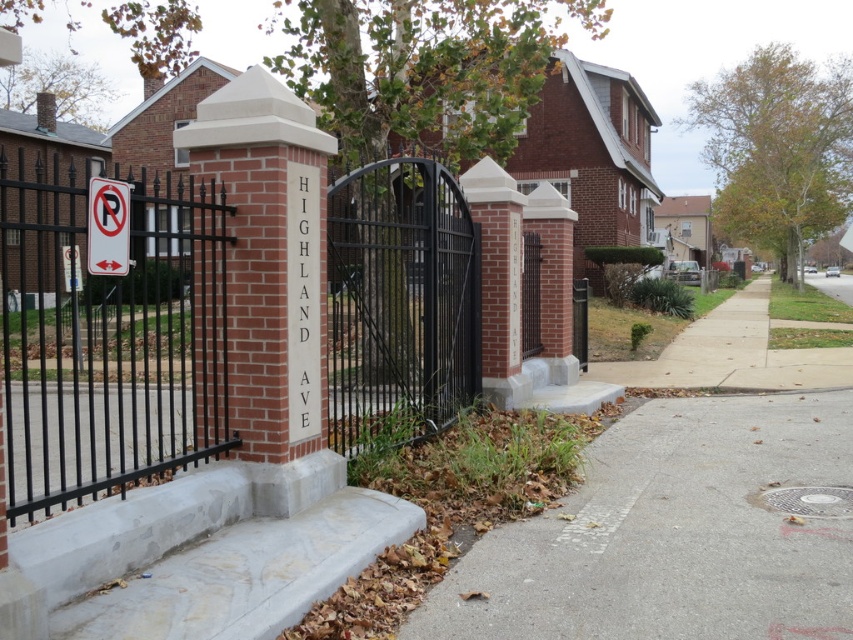
Which of these two, black wrought iron gate at left or gray concrete sidewalk at lower right, stands shorter?

gray concrete sidewalk at lower right

Can you confirm if black wrought iron gate at left is positioned to the left of gray concrete sidewalk at lower right?

Correct, you'll find black wrought iron gate at left to the left of gray concrete sidewalk at lower right.

In order to click on black wrought iron gate at left in this screenshot , I will do `click(109, 340)`.

Is white plastic sign at upper left thinner than metallic gate at center?

Yes, white plastic sign at upper left is thinner than metallic gate at center.

Who is positioned more to the right, white plastic sign at upper left or metallic gate at center?

From the viewer's perspective, metallic gate at center appears more on the right side.

The height and width of the screenshot is (640, 853). In order to click on white plastic sign at upper left in this screenshot , I will do `click(108, 227)`.

Can you confirm if black wrought iron gate at left is wider than metallic gate at center?

Correct, the width of black wrought iron gate at left exceeds that of metallic gate at center.

Which of these two, black wrought iron gate at left or metallic gate at center, stands shorter?

Standing shorter between the two is metallic gate at center.

This screenshot has width=853, height=640. I want to click on black wrought iron gate at left, so click(109, 340).